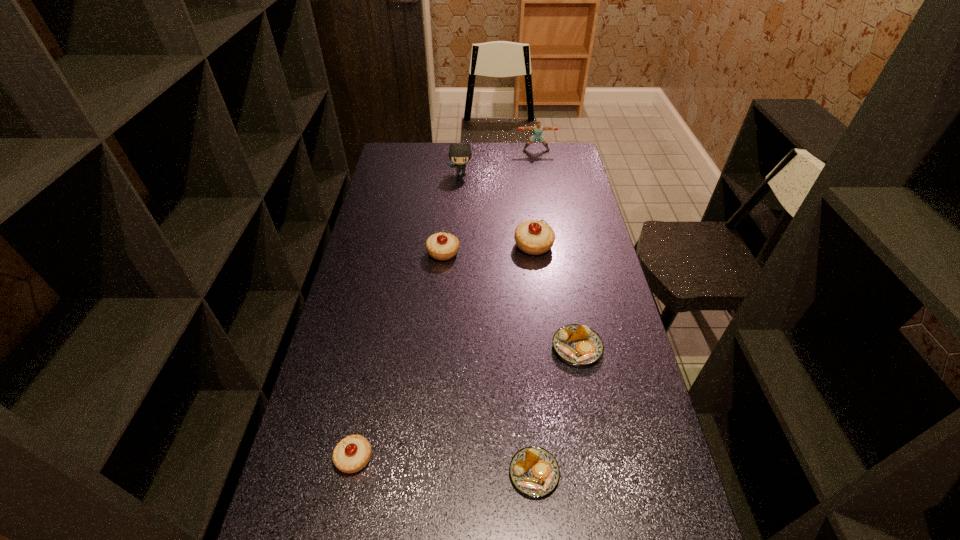
This screenshot has width=960, height=540. Find the location of `puncher`. puncher is located at coordinates (537, 129).

Where is `the farthest object`? This screenshot has width=960, height=540. the farthest object is located at coordinates (537, 129).

This screenshot has height=540, width=960. Find the location of `the sixth nearest object`. the sixth nearest object is located at coordinates (460, 154).

Where is `gray kitten`? gray kitten is located at coordinates (460, 154).

You are a GUI agent. You are given a task and a screenshot of the screen. Output one action in this format:
    pyautogui.click(x=<x>, y=<y>)
    Task: Click on the biggest beige pastry
    The image size is (960, 540).
    Given the screenshot: What is the action you would take?
    pyautogui.click(x=534, y=237)

You are a GUI agent. You are given a task and a screenshot of the screen. Output one action in this format:
    pyautogui.click(x=<x>, y=<y>)
    Task: Click on the tallest pastry
    The image size is (960, 540).
    Given the screenshot: What is the action you would take?
    pyautogui.click(x=534, y=237)

Locate an element on the screen. the second beige pastry from left to right is located at coordinates (441, 246).

Where is `the fourth pastry from right to left`? This screenshot has height=540, width=960. the fourth pastry from right to left is located at coordinates (441, 246).

Where is `the smallest beige pastry`? The image size is (960, 540). the smallest beige pastry is located at coordinates (351, 454).

Locate an element on the screen. This screenshot has width=960, height=540. the third tallest pastry is located at coordinates (351, 454).